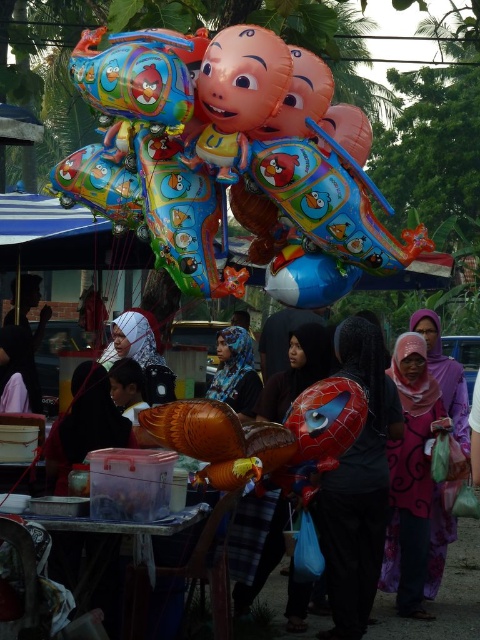
You are a photographer at the market and want to capture both the pink satin hijab at center and the blue printed scarf at center in a single shot. Which one should you focus on first to ensure both are in frame?

The pink satin hijab at center is above the blue printed scarf at center, so focusing on the pink satin hijab at center first will ensure both are captured in the frame.

You are at a cultural event where you see a purple printed scarf at center and a pink satin hijab at center. Which item is located below the other?

The purple printed scarf at center is positioned under the pink satin hijab at center, so the purple printed scarf is below the pink satin hijab.